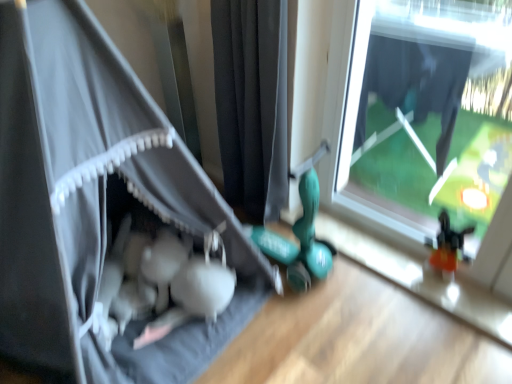
Question: Does transparent glass window at center have a smaller size compared to black fabric curtain at center, which is counted as the 1th curtain, starting from the right?

Choices:
 (A) no
 (B) yes

Answer: (B)

Question: From the image's perspective, is transparent glass window at center below black fabric curtain at center, which appears as the second curtain when viewed from the left?

Choices:
 (A) no
 (B) yes

Answer: (B)

Question: Is transparent glass window at center at the left side of black fabric curtain at center, which appears as the second curtain when viewed from the left?

Choices:
 (A) no
 (B) yes

Answer: (A)

Question: Does transparent glass window at center have a lesser width compared to black fabric curtain at center, which is counted as the 1th curtain, starting from the right?

Choices:
 (A) yes
 (B) no

Answer: (A)

Question: Does transparent glass window at center have a lesser height compared to black fabric curtain at center, which appears as the second curtain when viewed from the left?

Choices:
 (A) no
 (B) yes

Answer: (B)

Question: From the image's perspective, is black fabric curtain at center, which appears as the second curtain when viewed from the left, above or below matte gray tent at left, acting as the 1th curtain starting from the left?

Choices:
 (A) above
 (B) below

Answer: (A)

Question: Based on their sizes in the image, would you say black fabric curtain at center, which appears as the second curtain when viewed from the left, is bigger or smaller than matte gray tent at left, acting as the 1th curtain starting from the left?

Choices:
 (A) big
 (B) small

Answer: (B)

Question: Considering their positions, is black fabric curtain at center, which is counted as the 1th curtain, starting from the right, located in front of or behind matte gray tent at left, marked as the 2th curtain in a right-to-left arrangement?

Choices:
 (A) front
 (B) behind

Answer: (B)

Question: From a real-world perspective, is black fabric curtain at center, which appears as the second curtain when viewed from the left, physically located above or below matte gray tent at left, marked as the 2th curtain in a right-to-left arrangement?

Choices:
 (A) below
 (B) above

Answer: (A)

Question: Is black fabric curtain at center, which is counted as the 1th curtain, starting from the right, wider or thinner than transparent glass window at center?

Choices:
 (A) wide
 (B) thin

Answer: (A)

Question: From the image's perspective, relative to transparent glass window at center, is black fabric curtain at center, which is counted as the 1th curtain, starting from the right, above or below?

Choices:
 (A) below
 (B) above

Answer: (B)

Question: Relative to transparent glass window at center, is black fabric curtain at center, which appears as the second curtain when viewed from the left, in front or behind?

Choices:
 (A) behind
 (B) front

Answer: (A)

Question: Is point (266, 127) positioned closer to the camera than point (360, 51)?

Choices:
 (A) farther
 (B) closer

Answer: (A)

Question: Would you say transparent glass window at center is inside or outside black fabric curtain at center, which is counted as the 1th curtain, starting from the right?

Choices:
 (A) outside
 (B) inside

Answer: (A)

Question: Considering the positions of transparent glass window at center and black fabric curtain at center, which appears as the second curtain when viewed from the left, in the image, is transparent glass window at center wider or thinner than black fabric curtain at center, which appears as the second curtain when viewed from the left,?

Choices:
 (A) wide
 (B) thin

Answer: (B)